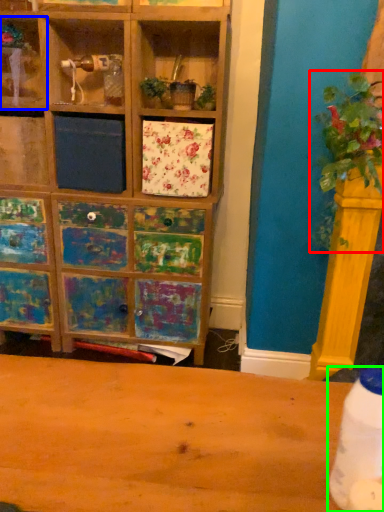
Question: Which object is the closest to the floral arrangement (highlighted by a red box)? Choose among these: shelf (highlighted by a blue box) or bottle (highlighted by a green box).

Choices:
 (A) shelf
 (B) bottle

Answer: (B)